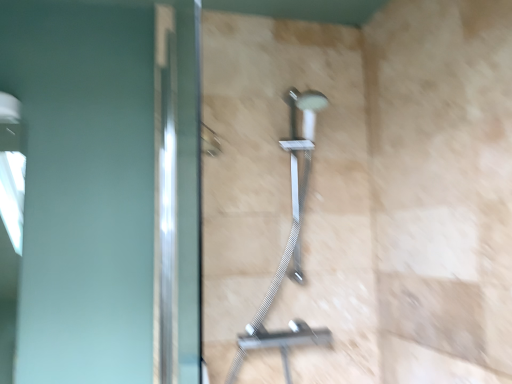
Question: Choose the correct answer: Is satin nickel shower at center inside polished silver screen door at left or outside it?

Choices:
 (A) outside
 (B) inside

Answer: (A)

Question: From a real-world perspective, is satin nickel shower at center above or below polished silver screen door at left?

Choices:
 (A) above
 (B) below

Answer: (B)

Question: Is point (303, 117) closer or farther from the camera than point (176, 230)?

Choices:
 (A) closer
 (B) farther

Answer: (B)

Question: From the image's perspective, relative to satin nickel shower at center, is polished silver screen door at left above or below?

Choices:
 (A) above
 (B) below

Answer: (A)

Question: Considering the positions of point (189, 203) and point (314, 119), is point (189, 203) closer or farther from the camera than point (314, 119)?

Choices:
 (A) farther
 (B) closer

Answer: (B)

Question: Considering the positions of polished silver screen door at left and satin nickel shower at center in the image, is polished silver screen door at left wider or thinner than satin nickel shower at center?

Choices:
 (A) wide
 (B) thin

Answer: (B)

Question: Considering the positions of polished silver screen door at left and satin nickel shower at center in the image, is polished silver screen door at left taller or shorter than satin nickel shower at center?

Choices:
 (A) short
 (B) tall

Answer: (B)